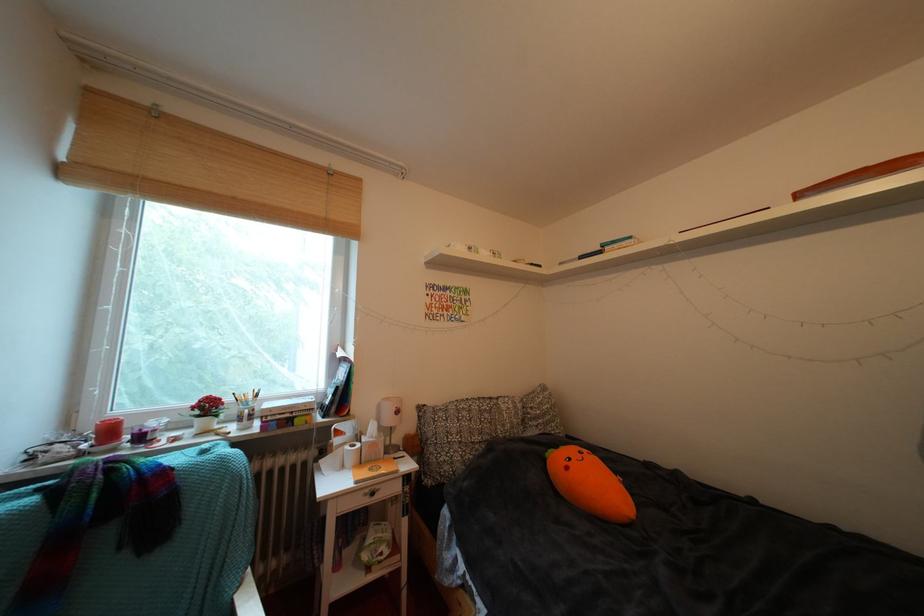
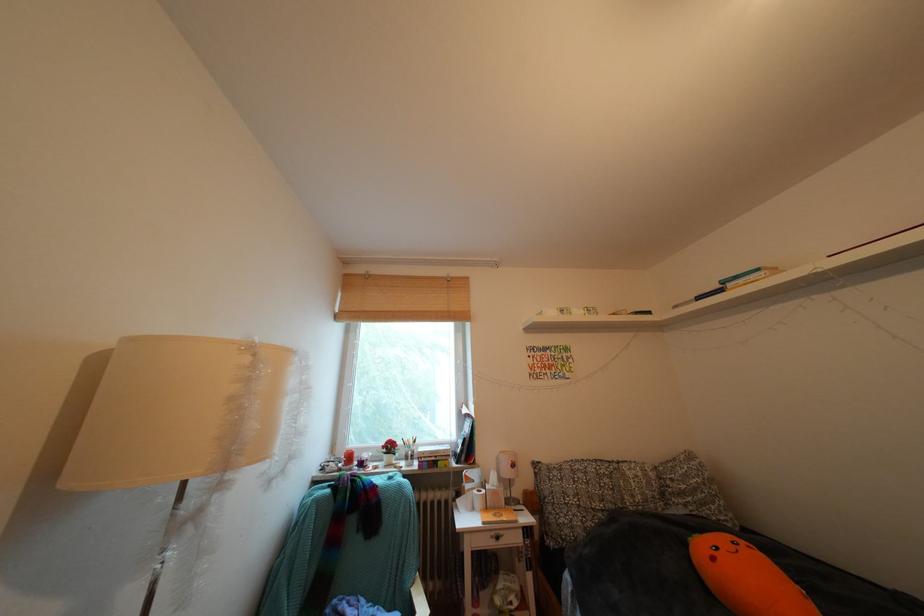
The point at (168, 120) is marked in the first image. Where is the corresponding point in the second image?

(379, 282)